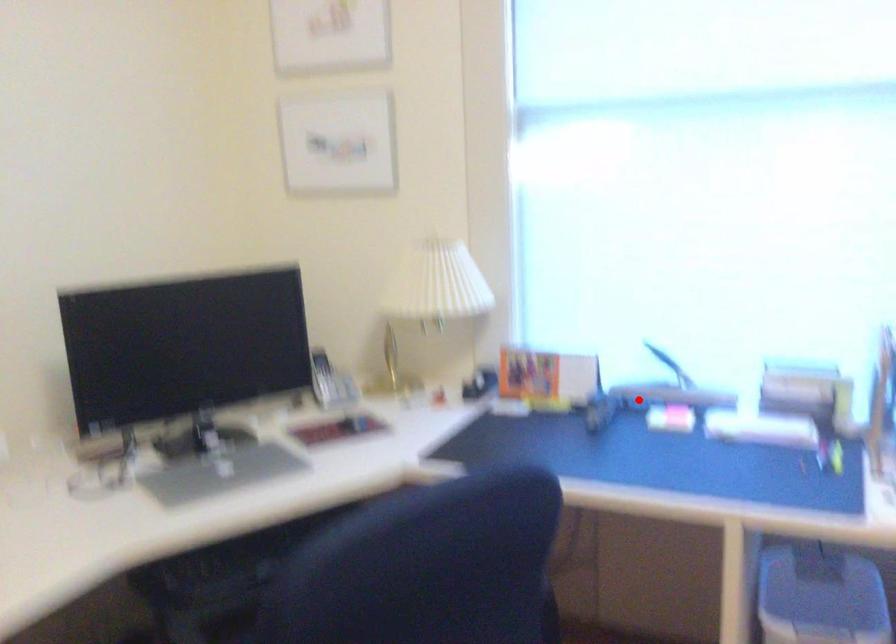
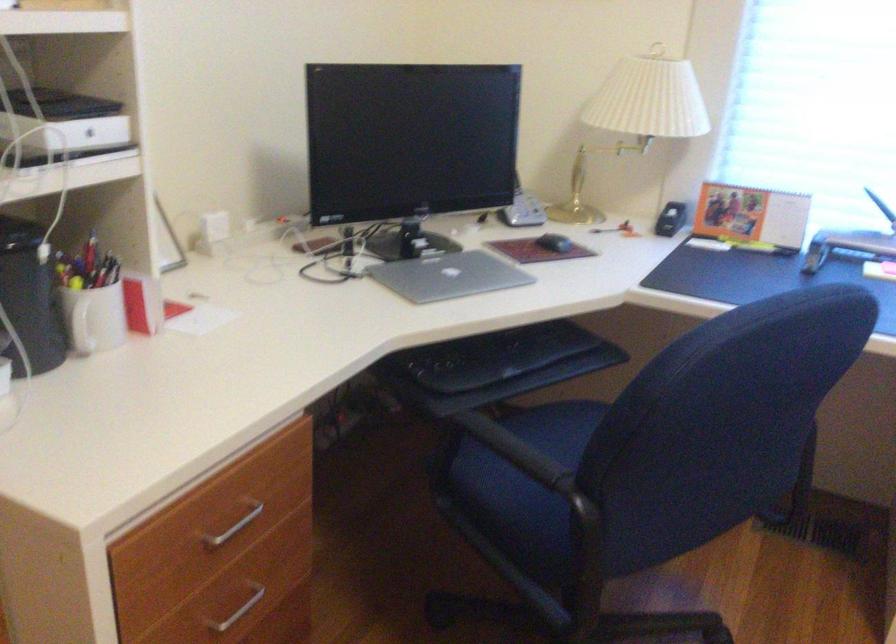
The point at the highlighted location is marked in the first image. Where is the corresponding point in the second image?

(847, 245)